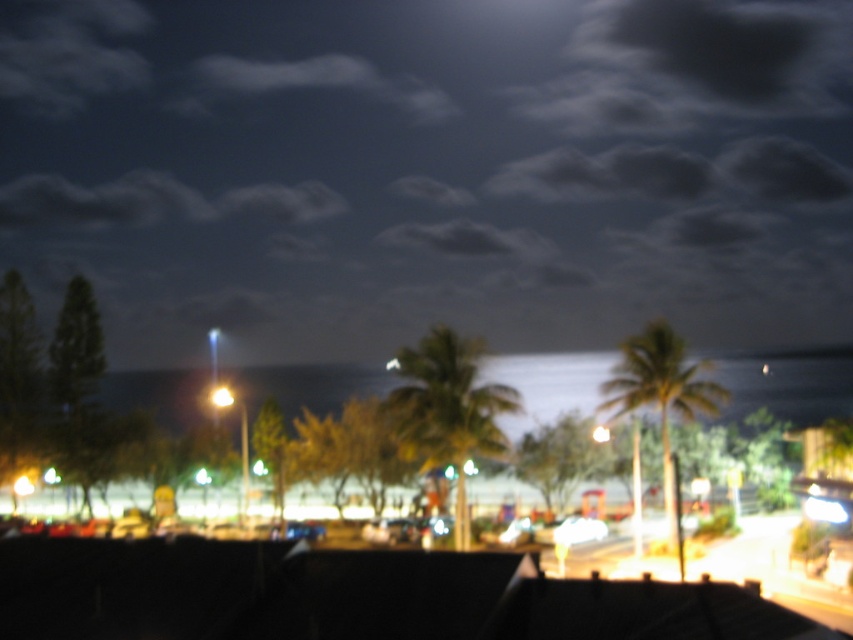
Is green leafy palm tree at center below green leafy palm tree at right?

No.

The image size is (853, 640). What do you see at coordinates (450, 410) in the screenshot?
I see `green leafy palm tree at center` at bounding box center [450, 410].

Who is more forward, (425, 403) or (689, 392)?

Point (425, 403) is more forward.

Locate an element on the screen. The image size is (853, 640). green leafy palm tree at center is located at coordinates (450, 410).

Is black matte roof at lower center to the left of green leafy palm tree at right from the viewer's perspective?

Correct, you'll find black matte roof at lower center to the left of green leafy palm tree at right.

Is point (701, 598) behind point (666, 337)?

No, it is in front of (666, 337).

In order to click on black matte roof at lower center in this screenshot , I will do 350,596.

Can you confirm if green leafy palm tree at right is positioned to the right of yellow matte light at center?

Yes, green leafy palm tree at right is to the right of yellow matte light at center.

Consider the image. Is green leafy palm tree at right above yellow matte light at center?

Incorrect, green leafy palm tree at right is not positioned above yellow matte light at center.

Find the location of a particular element. The image size is (853, 640). green leafy palm tree at right is located at coordinates (x=660, y=396).